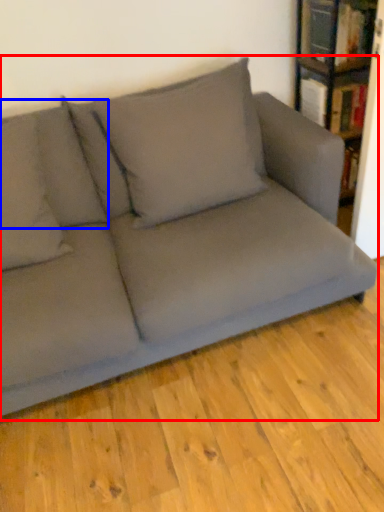
Question: Which of the following is the farthest to the observer, studio couch (highlighted by a red box) or pillow (highlighted by a blue box)?

Choices:
 (A) studio couch
 (B) pillow

Answer: (B)